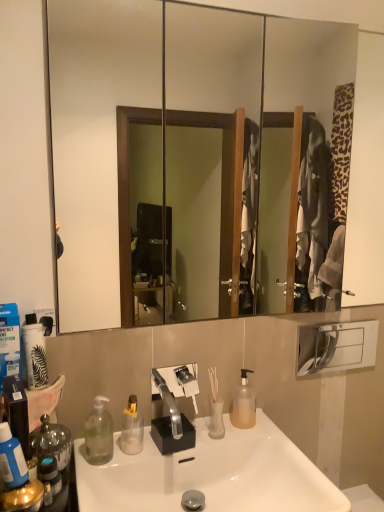
Question: Could you tell me if translucent plastic pump bottle at center, arranged as the fourth bottle when viewed from the left, is turned towards blue matte bottle at left, which is the 1th bottle from front to back?

Choices:
 (A) yes
 (B) no

Answer: (B)

Question: From a real-world perspective, is translucent plastic pump bottle at center, arranged as the fourth bottle when viewed from the left, under blue matte bottle at left, which is the 1th bottle from front to back?

Choices:
 (A) yes
 (B) no

Answer: (A)

Question: Does translucent plastic pump bottle at center, the 1th bottle from the back, lie in front of blue matte bottle at left, arranged as the fourth bottle when viewed from the back?

Choices:
 (A) yes
 (B) no

Answer: (B)

Question: From the image's perspective, is translucent plastic pump bottle at center, the 4th bottle in the front-to-back sequence, located beneath blue matte bottle at left, which is the 1th bottle from front to back?

Choices:
 (A) yes
 (B) no

Answer: (A)

Question: Does translucent plastic pump bottle at center, the 1th bottle from the back, appear on the right side of blue matte bottle at left, arranged as the fourth bottle when viewed from the back?

Choices:
 (A) yes
 (B) no

Answer: (A)

Question: Is translucent plastic pump bottle at center, the 4th bottle in the front-to-back sequence, not near blue matte bottle at left, acting as the 4th bottle starting from the right?

Choices:
 (A) yes
 (B) no

Answer: (B)

Question: Is translucent plastic pump bottle at center, arranged as the fourth bottle when viewed from the left, closer to the viewer compared to clear glass mirror at upper center?

Choices:
 (A) yes
 (B) no

Answer: (B)

Question: Can you confirm if translucent plastic pump bottle at center, arranged as the fourth bottle when viewed from the left, is taller than clear glass mirror at upper center?

Choices:
 (A) yes
 (B) no

Answer: (B)

Question: From a real-world perspective, does translucent plastic pump bottle at center, which is the 1th bottle from right to left, sit lower than clear glass mirror at upper center?

Choices:
 (A) no
 (B) yes

Answer: (B)

Question: Is translucent plastic pump bottle at center, the 4th bottle in the front-to-back sequence, positioned with its back to clear glass mirror at upper center?

Choices:
 (A) yes
 (B) no

Answer: (B)

Question: Is clear glass mirror at upper center a part of translucent plastic pump bottle at center, which is the 1th bottle from right to left?

Choices:
 (A) no
 (B) yes

Answer: (A)

Question: Could you tell me if translucent plastic pump bottle at center, which is the 1th bottle from right to left, is facing clear plastic bottle at lower left, arranged as the 2th bottle when viewed from the left?

Choices:
 (A) no
 (B) yes

Answer: (A)